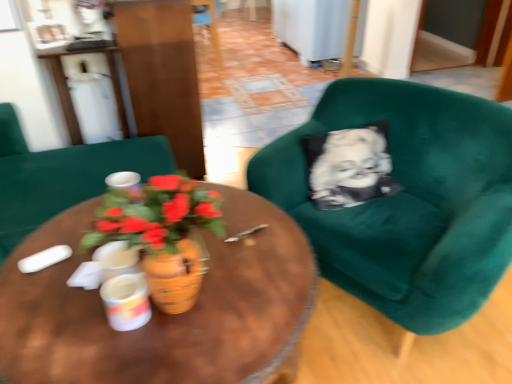
You are a GUI agent. You are given a task and a screenshot of the screen. Output one action in this format:
    pyautogui.click(x=<x>, y=<y>)
    Task: Click on the free location to the right of terracotta pot at center
    The height and width of the screenshot is (384, 512).
    Given the screenshot: What is the action you would take?
    pyautogui.click(x=257, y=292)